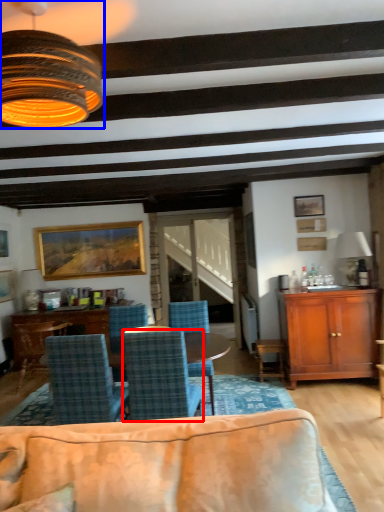
Question: Which object appears closest to the camera in this image, chair (highlighted by a red box) or lamp (highlighted by a blue box)?

Choices:
 (A) chair
 (B) lamp

Answer: (B)